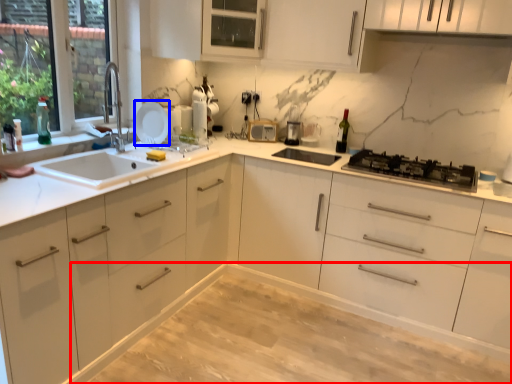
Question: Which object appears farthest to the camera in this image, dinning table (highlighted by a red box) or appliance (highlighted by a blue box)?

Choices:
 (A) dinning table
 (B) appliance

Answer: (B)